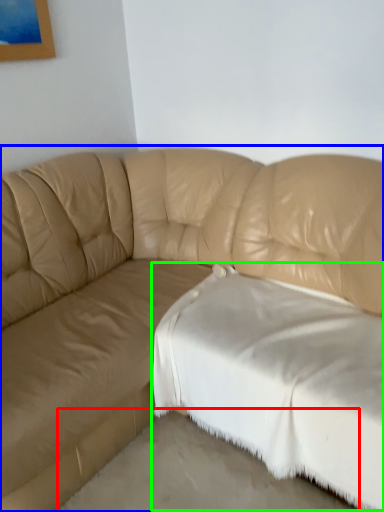
Question: Which object is positioned farthest from concrete (highlighted by a red box)? Select from studio couch (highlighted by a blue box) and sheet (highlighted by a green box).

Choices:
 (A) studio couch
 (B) sheet

Answer: (A)